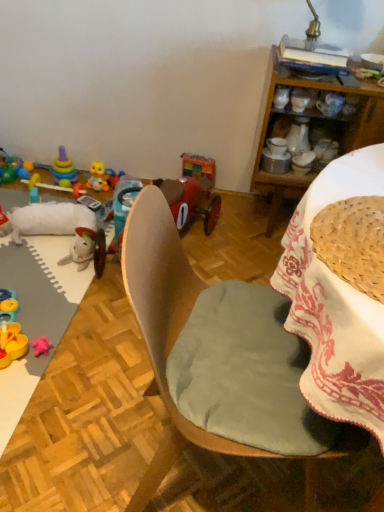
Question: Are wooden cabinet at upper right and woven straw basket at upper right located far from each other?

Choices:
 (A) no
 (B) yes

Answer: (B)

Question: Does wooden cabinet at upper right come in front of woven straw basket at upper right?

Choices:
 (A) no
 (B) yes

Answer: (A)

Question: Is wooden cabinet at upper right oriented away from woven straw basket at upper right?

Choices:
 (A) yes
 (B) no

Answer: (B)

Question: Is wooden cabinet at upper right at the right side of woven straw basket at upper right?

Choices:
 (A) no
 (B) yes

Answer: (B)

Question: Considering the relative sizes of wooden cabinet at upper right and woven straw basket at upper right in the image provided, is wooden cabinet at upper right taller than woven straw basket at upper right?

Choices:
 (A) yes
 (B) no

Answer: (A)

Question: From a real-world perspective, is wooden cabinet at upper right over woven straw basket at upper right?

Choices:
 (A) no
 (B) yes

Answer: (A)

Question: Considering the relative sizes of rubber duck at lower left, arranged as the third toy when viewed from the right, and white ceramic coffee cup at upper right, which is the 2th coffee cup in right-to-left order, in the image provided, is rubber duck at lower left, arranged as the third toy when viewed from the right, bigger than white ceramic coffee cup at upper right, which is the 2th coffee cup in right-to-left order,?

Choices:
 (A) no
 (B) yes

Answer: (B)

Question: Can you confirm if rubber duck at lower left, arranged as the third toy when viewed from the right, is shorter than white ceramic coffee cup at upper right, arranged as the 1th coffee cup when viewed from the left?

Choices:
 (A) no
 (B) yes

Answer: (A)

Question: From the image's perspective, is rubber duck at lower left, arranged as the third toy when viewed from the right, on white ceramic coffee cup at upper right, which is the 2th coffee cup in right-to-left order?

Choices:
 (A) no
 (B) yes

Answer: (A)

Question: Considering the relative sizes of rubber duck at lower left, arranged as the third toy when viewed from the right, and white ceramic coffee cup at upper right, which is the 2th coffee cup in right-to-left order, in the image provided, is rubber duck at lower left, arranged as the third toy when viewed from the right, smaller than white ceramic coffee cup at upper right, which is the 2th coffee cup in right-to-left order,?

Choices:
 (A) yes
 (B) no

Answer: (B)

Question: Is rubber duck at lower left, arranged as the third toy when viewed from the right, positioned far away from white ceramic coffee cup at upper right, arranged as the 1th coffee cup when viewed from the left?

Choices:
 (A) yes
 (B) no

Answer: (A)

Question: Is rubber duck at lower left, arranged as the third toy when viewed from the right, positioned with its back to white ceramic coffee cup at upper right, which is the 2th coffee cup in right-to-left order?

Choices:
 (A) no
 (B) yes

Answer: (A)

Question: From the image's perspective, does wooden chair at center appear lower than woven straw basket at upper right?

Choices:
 (A) yes
 (B) no

Answer: (A)